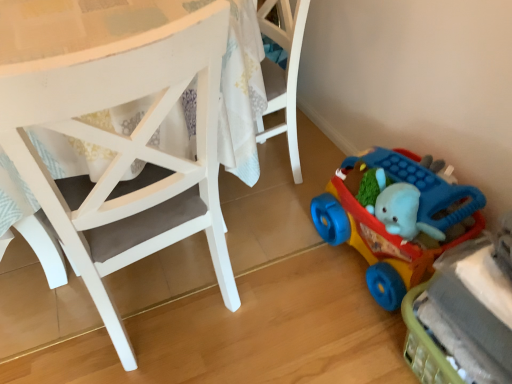
Question: From the image's perspective, is white matte chair at center under rubberized plastic toy car at lower right, the 1th toy from the top?

Choices:
 (A) yes
 (B) no

Answer: (B)

Question: Is white matte chair at center to the left of rubberized plastic toy car at lower right, acting as the 2th toy starting from the bottom, from the viewer's perspective?

Choices:
 (A) no
 (B) yes

Answer: (B)

Question: Is white matte chair at center located outside rubberized plastic toy car at lower right, the 1th toy from the top?

Choices:
 (A) yes
 (B) no

Answer: (A)

Question: Is white matte chair at center at the right side of rubberized plastic toy car at lower right, acting as the 2th toy starting from the bottom?

Choices:
 (A) no
 (B) yes

Answer: (A)

Question: Can you confirm if white matte chair at center is smaller than rubberized plastic toy car at lower right, acting as the 2th toy starting from the bottom?

Choices:
 (A) yes
 (B) no

Answer: (B)

Question: Would you say rubberized plastic toy car at lower right, acting as the 2th toy starting from the bottom, is inside or outside white matte chair at center?

Choices:
 (A) outside
 (B) inside

Answer: (A)

Question: Is rubberized plastic toy car at lower right, acting as the 2th toy starting from the bottom, taller or shorter than white matte chair at center?

Choices:
 (A) short
 (B) tall

Answer: (A)

Question: Is rubberized plastic toy car at lower right, the 1th toy from the top, bigger or smaller than white matte chair at center?

Choices:
 (A) small
 (B) big

Answer: (A)

Question: From a real-world perspective, relative to white matte chair at center, is rubberized plastic toy car at lower right, acting as the 2th toy starting from the bottom, vertically above or below?

Choices:
 (A) above
 (B) below

Answer: (B)

Question: Is point (207, 168) closer or farther from the camera than point (428, 324)?

Choices:
 (A) closer
 (B) farther

Answer: (A)

Question: Do you think white matte chair at center is within rubberized plastic toy car at lower right, the first toy from the bottom, or outside of it?

Choices:
 (A) inside
 (B) outside

Answer: (B)

Question: From a real-world perspective, relative to rubberized plastic toy car at lower right, arranged as the 2th toy when viewed from the top, is white matte chair at center vertically above or below?

Choices:
 (A) below
 (B) above

Answer: (B)

Question: From the image's perspective, is white matte chair at center above or below rubberized plastic toy car at lower right, arranged as the 2th toy when viewed from the top?

Choices:
 (A) above
 (B) below

Answer: (A)

Question: Relative to rubberized plastic toy car at lower right, the first toy from the bottom, is rubberized plastic toy car at lower right, acting as the 2th toy starting from the bottom, in front or behind?

Choices:
 (A) behind
 (B) front

Answer: (A)

Question: Is rubberized plastic toy car at lower right, the 1th toy from the top, bigger or smaller than rubberized plastic toy car at lower right, arranged as the 2th toy when viewed from the top?

Choices:
 (A) small
 (B) big

Answer: (B)